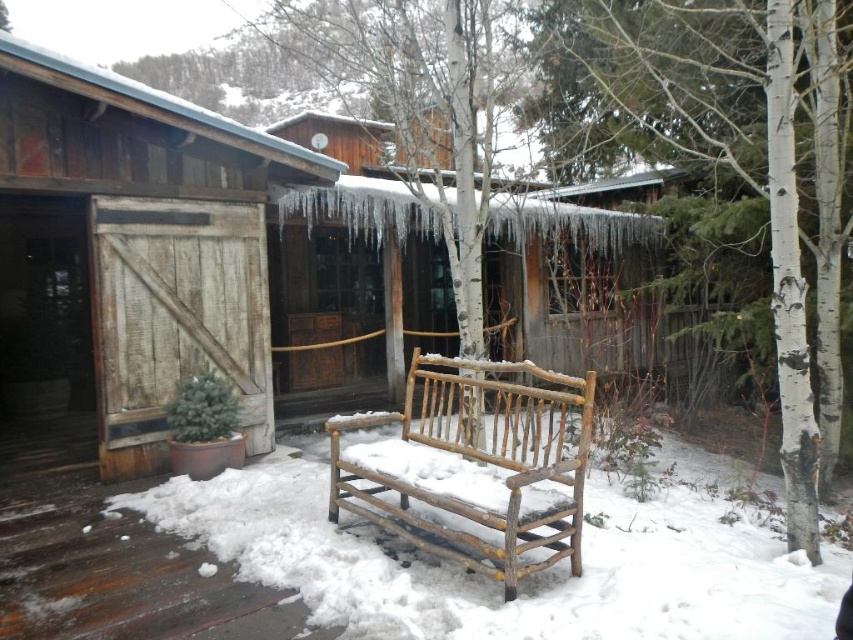
Can you confirm if white bark tree at center right is positioned below weathered wood barn door at left?

Actually, white bark tree at center right is above weathered wood barn door at left.

Describe the element at coordinates (708, 154) in the screenshot. I see `white bark tree at center right` at that location.

Who is more forward, (x=621, y=74) or (x=216, y=317)?

Point (x=216, y=317) is in front.

Find the location of `white bark tree at center right`. white bark tree at center right is located at coordinates (708, 154).

Does weathered wood cabin at left have a greater height compared to white bark tree at center right?

No.

Which of these two, weathered wood cabin at left or white bark tree at center right, stands shorter?

weathered wood cabin at left is shorter.

Does point (202, 333) come closer to viewer compared to point (817, 477)?

No.

What are the coordinates of `weathered wood cabin at left` in the screenshot? It's located at (131, 250).

Is weathered wood cabin at left taller than rustic wood bench at center?

No, weathered wood cabin at left is not taller than rustic wood bench at center.

At what (x,y) coordinates should I click in order to perform the action: click on weathered wood cabin at left. Please return your answer as a coordinate pair (x, y). Looking at the image, I should click on (131, 250).

Image resolution: width=853 pixels, height=640 pixels. I want to click on weathered wood cabin at left, so click(131, 250).